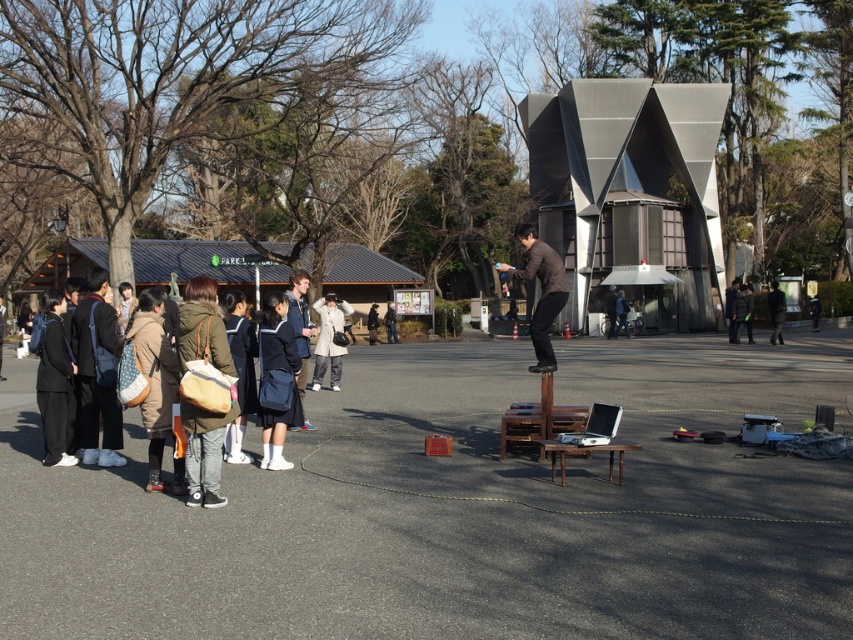
You are a photographer trying to capture a clear shot of the performer jumping over the table. You notice two jackets in the background, the dark blue jacket at left and the brown leather jacket at center. Which jacket is less likely to block your view of the performer?

The dark blue jacket at left is thinner than the brown leather jacket at center, so it is less likely to block your view of the performer.

You are a photographer trying to capture a photo of the performer jumping over the table. You notice two jackets in the background, the dark blue jacket at left and the brown leather jacket at center. Which jacket would appear larger in your photo if you focus on the performer?

The brown leather jacket at center would appear larger in the photo because it is taller than the dark blue jacket at left.